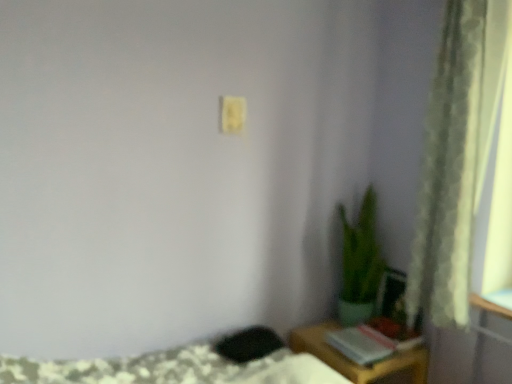
Question: Considering the positions of yellow matte light switch at upper center and hardcover book at lower right in the image, is yellow matte light switch at upper center taller or shorter than hardcover book at lower right?

Choices:
 (A) short
 (B) tall

Answer: (B)

Question: Considering the positions of point (240, 127) and point (359, 360), is point (240, 127) closer or farther from the camera than point (359, 360)?

Choices:
 (A) farther
 (B) closer

Answer: (A)

Question: Considering the real-world distances, which object is farthest from the green textured curtain at right?

Choices:
 (A) hardcover book at lower right
 (B) yellow matte light switch at upper center
 (C) wooden table at lower right
 (D) green matte plant at lower right

Answer: (B)

Question: Estimate the real-world distances between objects in this image. Which object is farther from the wooden table at lower right?

Choices:
 (A) yellow matte light switch at upper center
 (B) green textured curtain at right
 (C) green matte plant at lower right
 (D) hardcover book at lower right

Answer: (A)